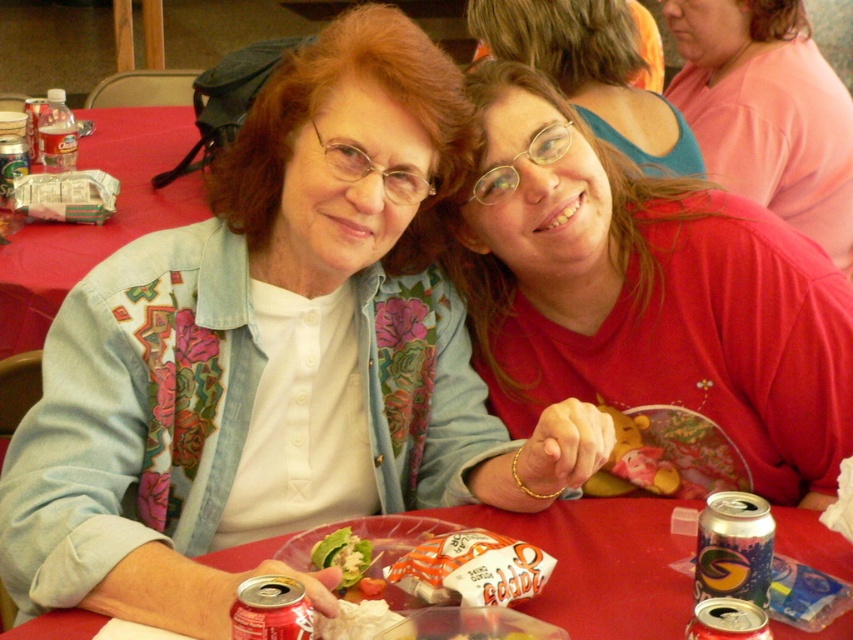
You are a photographer taking a picture of the scene. The pink matte shirt at upper right and the red plastic table at lower center are both in your view. Which object is closer to the camera?

The pink matte shirt at upper right is closer to the camera because it is positioned over the red plastic table at lower center.

You are a photographer taking a picture of the two people at the table. You want to ensure that the red matte shirt at upper right and the pink matte shirt at upper right are both clearly visible in the frame. Which shirt should you position closer to the center of the image to achieve this?

The red matte shirt at upper right is to the left of the pink matte shirt at upper right, so positioning the red matte shirt at upper right closer to the center would ensure both shirts are visible as it is already positioned to the left side relative to the pink one.